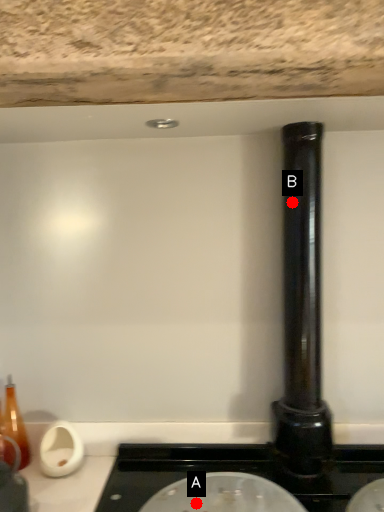
Question: Two points are circled on the image, labeled by A and B beside each circle. Which point is farther from the camera taking this photo?

Choices:
 (A) A is further
 (B) B is further

Answer: (B)